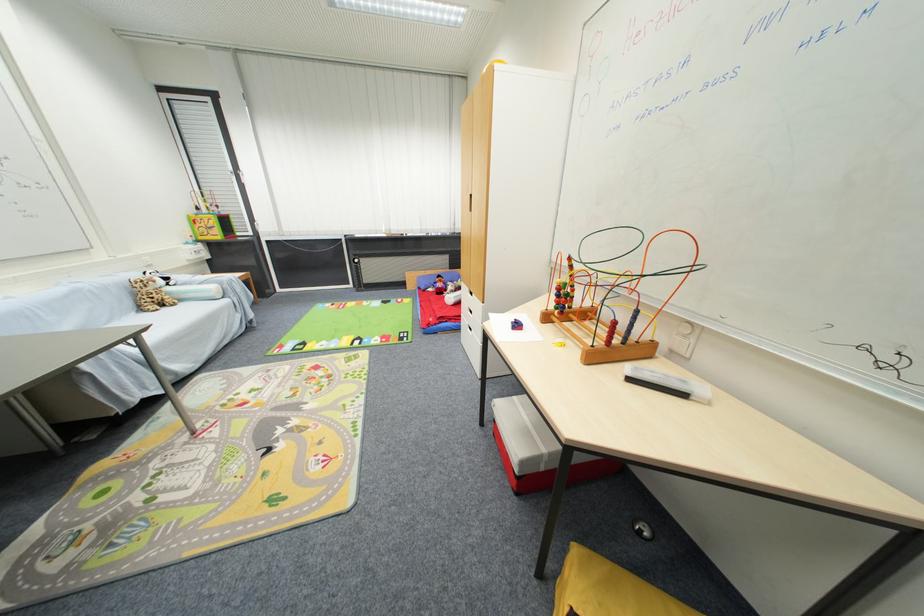
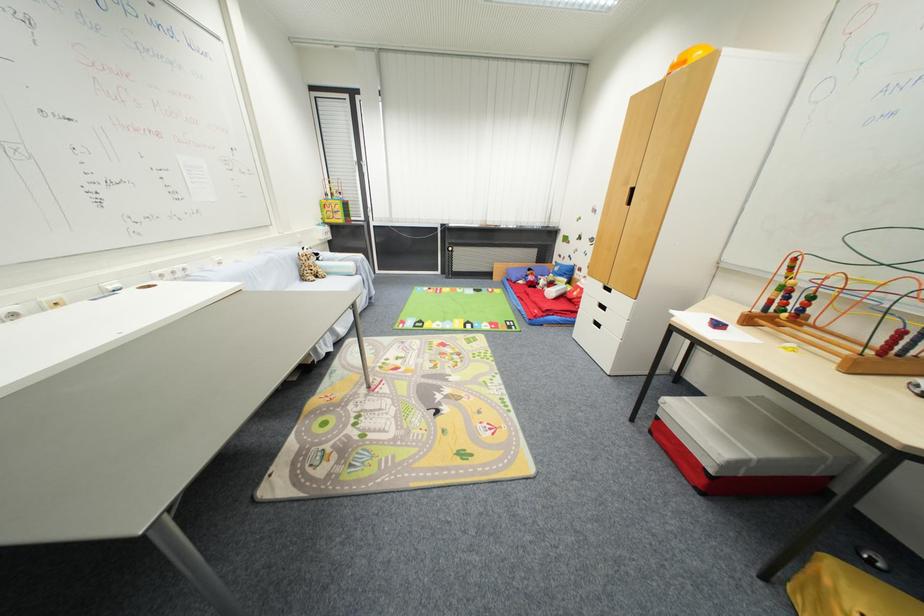
Question: The images are taken continuously from a first-person perspective. In which direction are you moving?

Choices:
 (A) Left
 (B) Right
 (C) Forward
 (D) Backward

Answer: (A)